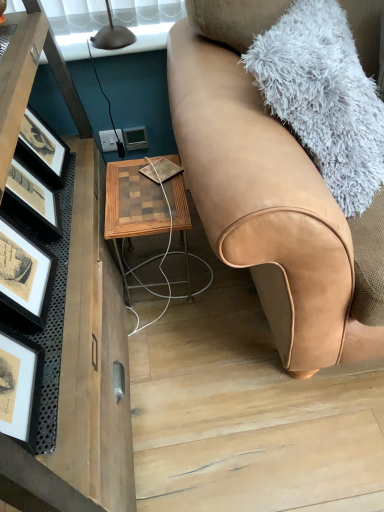
Question: Is tan leather couch at right completely or partially inside matte gray thermostat at center?

Choices:
 (A) yes
 (B) no

Answer: (B)

Question: From a real-world perspective, is matte gray thermostat at center beneath tan leather couch at right?

Choices:
 (A) yes
 (B) no

Answer: (A)

Question: From a real-world perspective, is matte gray thermostat at center positioned over tan leather couch at right based on gravity?

Choices:
 (A) yes
 (B) no

Answer: (B)

Question: Considering the relative sizes of matte gray thermostat at center and tan leather couch at right in the image provided, is matte gray thermostat at center taller than tan leather couch at right?

Choices:
 (A) yes
 (B) no

Answer: (B)

Question: Does matte gray thermostat at center have a lesser height compared to tan leather couch at right?

Choices:
 (A) yes
 (B) no

Answer: (A)

Question: From the image's perspective, relative to matte gray thermostat at center, is woodenmaterial/texturetable at center above or below?

Choices:
 (A) above
 (B) below

Answer: (B)

Question: Choose the correct answer: Is woodenmaterial/texturetable at center inside matte gray thermostat at center or outside it?

Choices:
 (A) inside
 (B) outside

Answer: (B)

Question: Is point (132, 188) positioned closer to the camera than point (125, 136)?

Choices:
 (A) closer
 (B) farther

Answer: (A)

Question: From a real-world perspective, is woodenmaterial/texturetable at center positioned above or below matte gray thermostat at center?

Choices:
 (A) above
 (B) below

Answer: (B)

Question: From a real-world perspective, is matte gray thermostat at center positioned above or below tan leather couch at right?

Choices:
 (A) above
 (B) below

Answer: (B)

Question: Would you say matte gray thermostat at center is to the left or to the right of tan leather couch at right in the picture?

Choices:
 (A) left
 (B) right

Answer: (A)

Question: Considering the positions of matte gray thermostat at center and tan leather couch at right in the image, is matte gray thermostat at center bigger or smaller than tan leather couch at right?

Choices:
 (A) small
 (B) big

Answer: (A)

Question: Considering the positions of point (142, 136) and point (208, 69), is point (142, 136) closer or farther from the camera than point (208, 69)?

Choices:
 (A) closer
 (B) farther

Answer: (B)

Question: Considering the positions of tan leather couch at right and matte gray thermostat at center in the image, is tan leather couch at right wider or thinner than matte gray thermostat at center?

Choices:
 (A) thin
 (B) wide

Answer: (B)

Question: Visually, is tan leather couch at right positioned to the left or to the right of matte gray thermostat at center?

Choices:
 (A) right
 (B) left

Answer: (A)